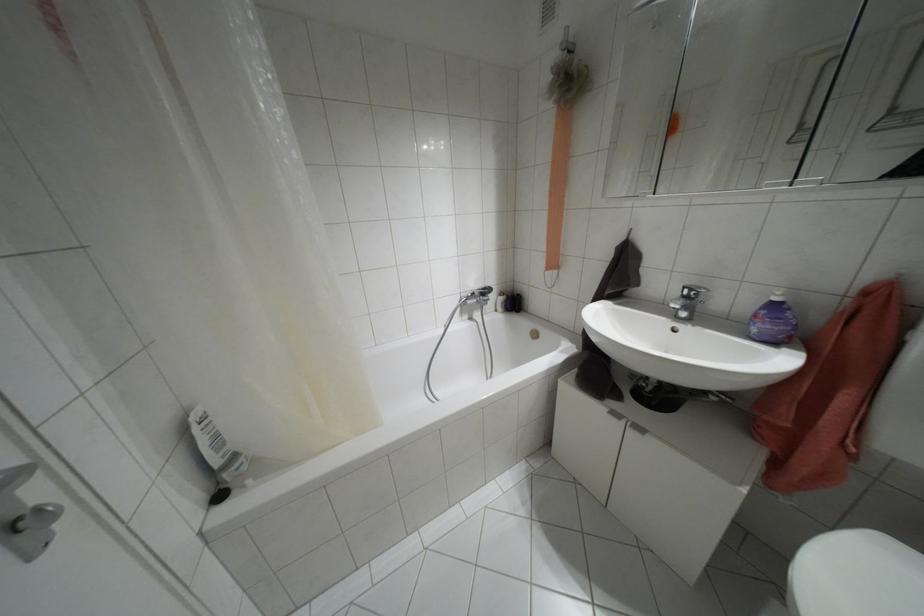
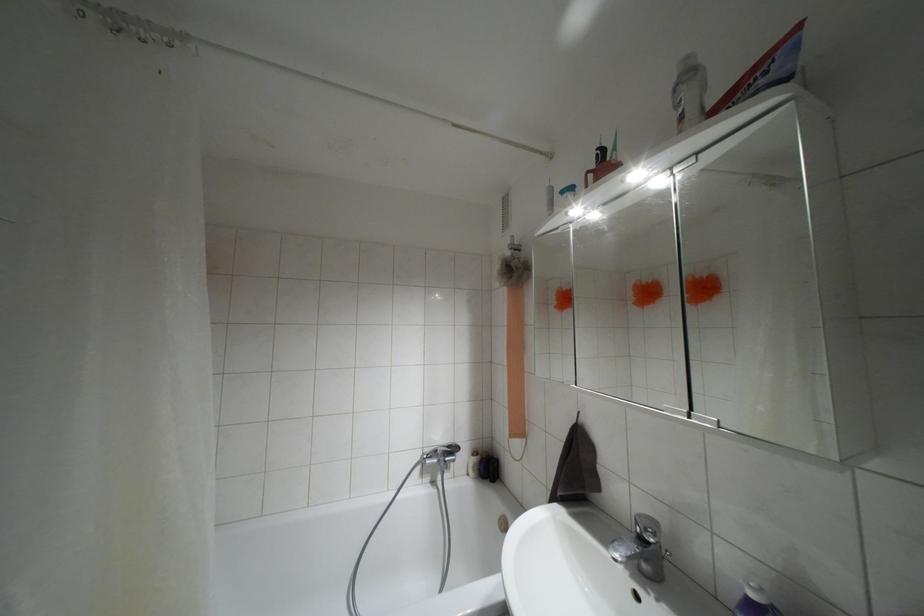
Find the pixel in the second image that matches point (686, 297) in the first image.

(641, 538)